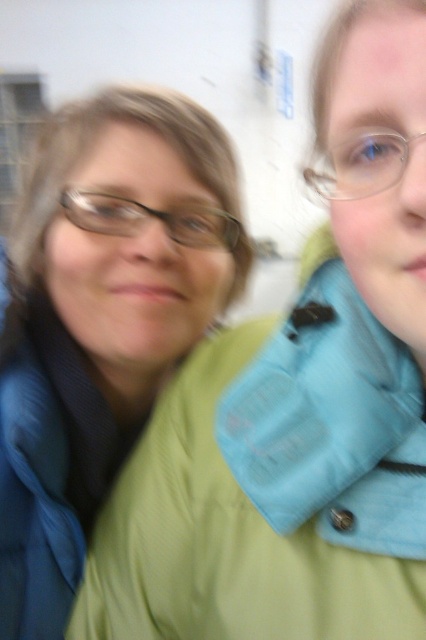
Question: Is green matte jacket at upper left smaller than clear plastic glasses at upper right?

Choices:
 (A) yes
 (B) no

Answer: (B)

Question: Is green matte jacket at upper left bigger than clear plastic glasses at upper right?

Choices:
 (A) no
 (B) yes

Answer: (B)

Question: Does green matte jacket at upper left appear under clear plastic glasses at upper right?

Choices:
 (A) yes
 (B) no

Answer: (A)

Question: Estimate the real-world distances between objects in this image. Which object is closer to the clear plastic glasses at upper right?

Choices:
 (A) matte black glasses at left
 (B) green matte jacket at upper left

Answer: (A)

Question: Which object is the closest to the matte black glasses at left?

Choices:
 (A) green matte jacket at upper left
 (B) clear plastic glasses at upper right

Answer: (A)

Question: Which point appears closest to the camera in this image?

Choices:
 (A) (365, 131)
 (B) (219, 211)

Answer: (A)